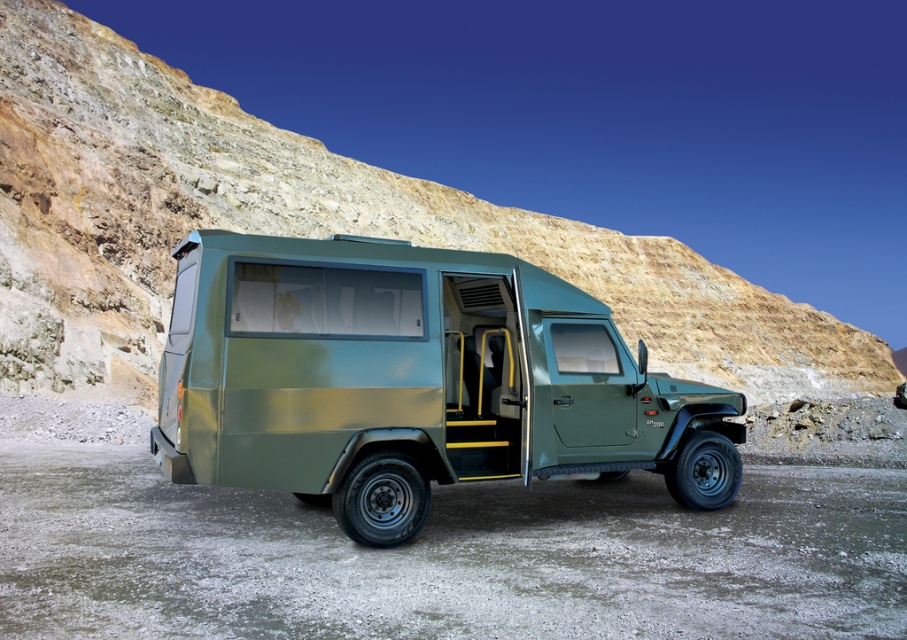
You are standing in front of the matte green truck at center and the green matte jeep at center. Which vehicle is closer to you?

The matte green truck at center is closer to you because it is positioned further to the viewer than the green matte jeep at center.

You are a delivery person who needs to park your vehicle in a narrow parking spot that can only accommodate a vehicle width of 2 meters. You have two options to choose from in the image, the matte green truck at center and the green matte jeep at center. Which vehicle should you choose to fit into the parking spot?

The green matte jeep at center has a smaller width than the matte green truck at center. Since the parking spot can only accommodate a vehicle width of 2 meters, you should choose the green matte jeep at center as it is narrower and more likely to fit within the space.